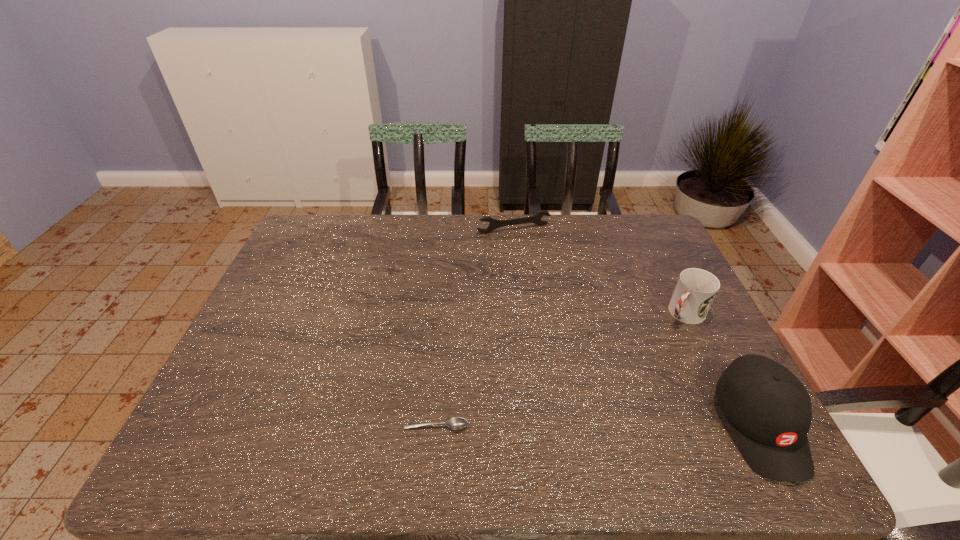
You are a GUI agent. You are given a task and a screenshot of the screen. Output one action in this format:
    pyautogui.click(x=<x>, y=<y>)
    Task: Click on the vacant space in between the soupspoon and the baseball cap
    
    Given the screenshot: What is the action you would take?
    pyautogui.click(x=598, y=426)

Locate an element on the screen. free space between the second object from left to right and the cup is located at coordinates (599, 271).

Where is `vacant space in between the baseball cap and the cup`? The width and height of the screenshot is (960, 540). vacant space in between the baseball cap and the cup is located at coordinates (722, 369).

The image size is (960, 540). I want to click on vacant region between the farthest object and the cup, so click(x=599, y=271).

You are a GUI agent. You are given a task and a screenshot of the screen. Output one action in this format:
    pyautogui.click(x=<x>, y=<y>)
    Task: Click on the object that stands as the second closest to the shortest object
    This screenshot has height=540, width=960.
    Given the screenshot: What is the action you would take?
    pyautogui.click(x=695, y=291)

Locate an element on the screen. This screenshot has width=960, height=540. the closest object relative to the baseball cap is located at coordinates (695, 291).

This screenshot has height=540, width=960. Identify the location of free region that satisfies the following two spatial constraints: 1. on the back side of the second object from left to right; 2. on the right side of the leftmost object. (452, 230).